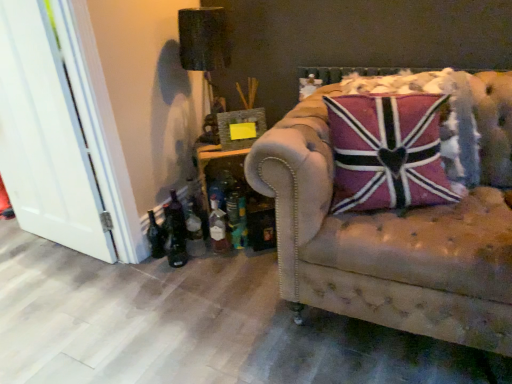
Question: Is green glass bottle at lower left thinner than dark glass bottle at lower left, which is the 1th bottle from left to right?

Choices:
 (A) no
 (B) yes

Answer: (B)

Question: From a real-world perspective, is green glass bottle at lower left over dark glass bottle at lower left, which is the 1th bottle from left to right?

Choices:
 (A) yes
 (B) no

Answer: (A)

Question: Is green glass bottle at lower left further to the viewer compared to dark glass bottle at lower left, the 3th bottle when ordered from right to left?

Choices:
 (A) no
 (B) yes

Answer: (B)

Question: Would you say green glass bottle at lower left contains dark glass bottle at lower left, the 3th bottle when ordered from right to left?

Choices:
 (A) yes
 (B) no

Answer: (B)

Question: Does green glass bottle at lower left have a greater height compared to dark glass bottle at lower left, which is the 1th bottle from left to right?

Choices:
 (A) no
 (B) yes

Answer: (B)

Question: From a real-world perspective, is pink fabric pillow at center physically located above or below white wood door at left?

Choices:
 (A) above
 (B) below

Answer: (A)

Question: Based on their sizes in the image, would you say pink fabric pillow at center is bigger or smaller than white wood door at left?

Choices:
 (A) small
 (B) big

Answer: (B)

Question: From the image's perspective, is pink fabric pillow at center above or below white wood door at left?

Choices:
 (A) above
 (B) below

Answer: (B)

Question: Is point (348, 134) closer or farther from the camera than point (41, 198)?

Choices:
 (A) closer
 (B) farther

Answer: (A)

Question: In terms of width, does dark glass bottle at lower left, which is the 1th bottle from left to right, look wider or thinner when compared to white wood door at left?

Choices:
 (A) wide
 (B) thin

Answer: (A)

Question: From their relative heights in the image, would you say dark glass bottle at lower left, which is the 1th bottle from left to right, is taller or shorter than white wood door at left?

Choices:
 (A) short
 (B) tall

Answer: (A)

Question: Does point (157, 258) appear closer or farther from the camera than point (76, 160)?

Choices:
 (A) closer
 (B) farther

Answer: (B)

Question: Looking at the image, does dark glass bottle at lower left, which is the 1th bottle from left to right, seem bigger or smaller compared to white wood door at left?

Choices:
 (A) big
 (B) small

Answer: (B)

Question: Is translucent glass bottle at lower left, the 1th bottle viewed from the right, inside or outside of white wood door at left?

Choices:
 (A) outside
 (B) inside

Answer: (A)

Question: In terms of height, does translucent glass bottle at lower left, the 1th bottle viewed from the right, look taller or shorter compared to white wood door at left?

Choices:
 (A) tall
 (B) short

Answer: (B)